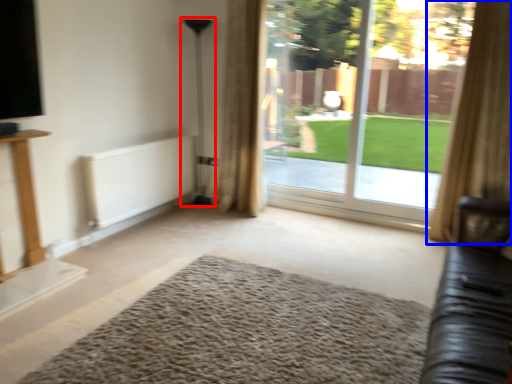
Question: Which of the following is the farthest to the observer, lamp (highlighted by a red box) or curtain (highlighted by a blue box)?

Choices:
 (A) lamp
 (B) curtain

Answer: (A)